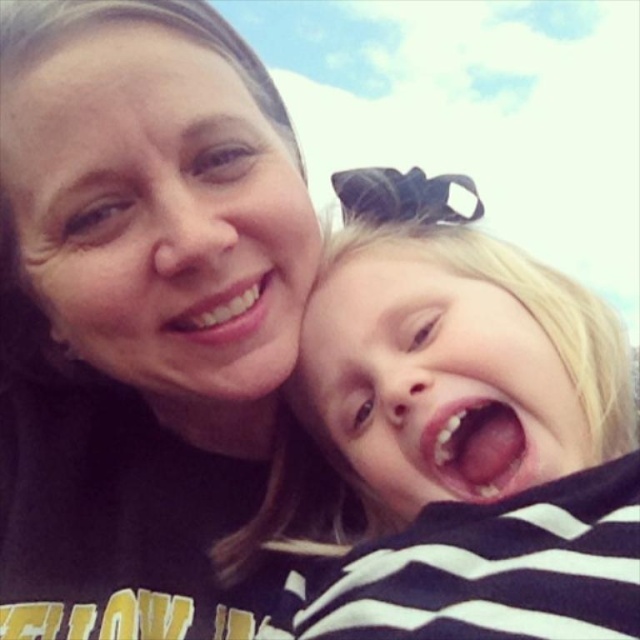
Can you confirm if matte black shirt at center is smaller than striped fabric shirt at right?

Incorrect, matte black shirt at center is not smaller in size than striped fabric shirt at right.

Between matte black shirt at center and striped fabric shirt at right, which one appears on the left side from the viewer's perspective?

matte black shirt at center is more to the left.

From the picture: Who is more forward, (131, 305) or (531, 588)?

Point (531, 588) is more forward.

This screenshot has width=640, height=640. In order to click on matte black shirt at center in this screenshot , I will do `click(140, 314)`.